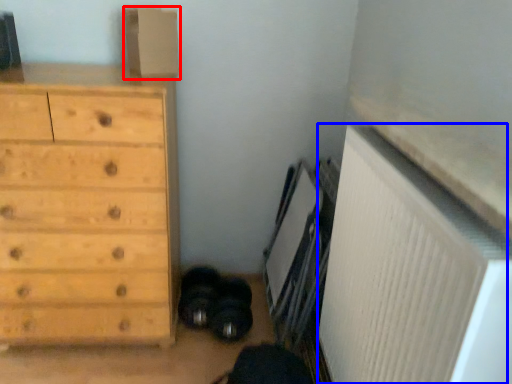
Question: Which of the following is the farthest to the observer, cardboard box (highlighted by a red box) or radiator (highlighted by a blue box)?

Choices:
 (A) cardboard box
 (B) radiator

Answer: (A)